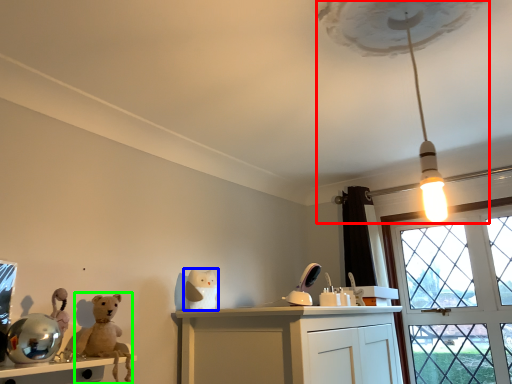
Question: Which is nearer to the lamp (highlighted by a red box)? toy (highlighted by a blue box) or animal (highlighted by a green box).

Choices:
 (A) toy
 (B) animal

Answer: (A)